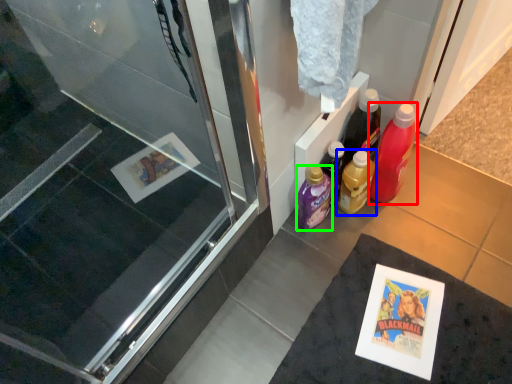
Question: Which object is positioned farthest from bottle (highlighted by a red box)? Select from bottle (highlighted by a blue box) and bottle (highlighted by a green box).

Choices:
 (A) bottle
 (B) bottle

Answer: (B)